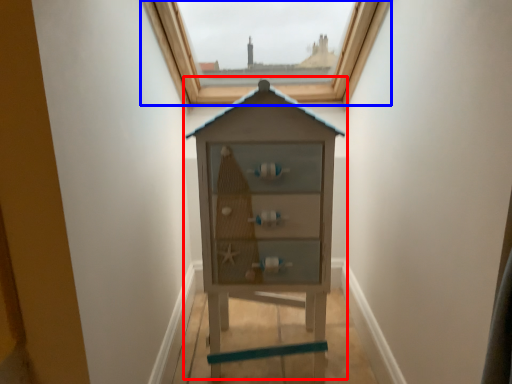
Question: Which of the following is the farthest to the observer, dresser (highlighted by a red box) or window (highlighted by a blue box)?

Choices:
 (A) dresser
 (B) window

Answer: (B)